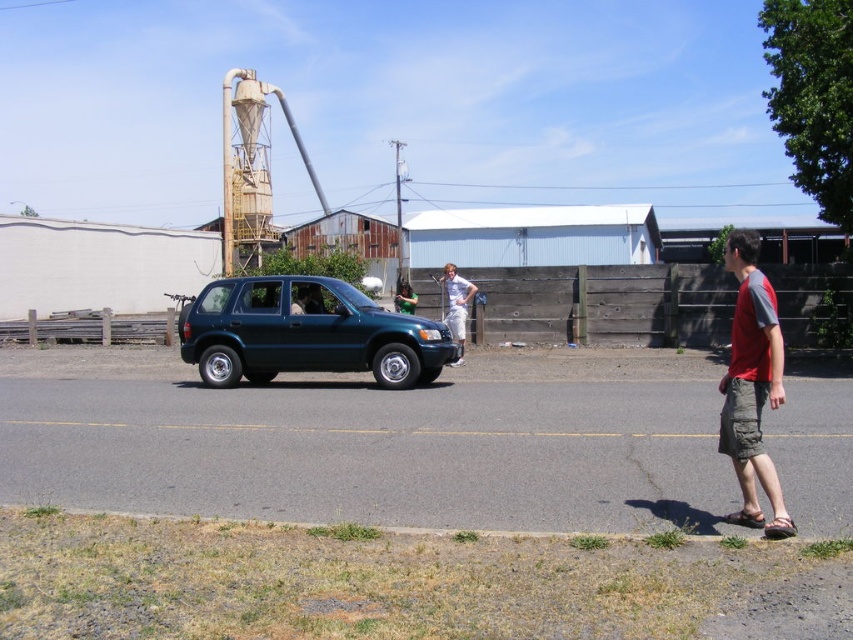
Between point (730, 248) and point (409, 300), which one is positioned behind?

Point (409, 300)

Who is more forward, [730,394] or [408,296]?

Point [730,394] is more forward.

This screenshot has width=853, height=640. What do you see at coordinates (752, 385) in the screenshot? I see `red cotton shirt at right` at bounding box center [752, 385].

At what (x,y) coordinates should I click in order to perform the action: click on red cotton shirt at right. Please return your answer as a coordinate pair (x, y). Image resolution: width=853 pixels, height=640 pixels. Looking at the image, I should click on (752, 385).

Who is positioned more to the right, white matte pants at center or green fabric shirt at center?

white matte pants at center is more to the right.

Is point (462, 342) more distant than point (405, 304)?

No, (462, 342) is in front of (405, 304).

Locate an element on the screen. This screenshot has width=853, height=640. white matte pants at center is located at coordinates (456, 305).

Is glossy dark green suv at center below white matte pants at center?

Yes.

Which is behind, point (178, 349) or point (459, 291)?

Point (178, 349)

Identify the location of glossy dark green suv at center. (305, 332).